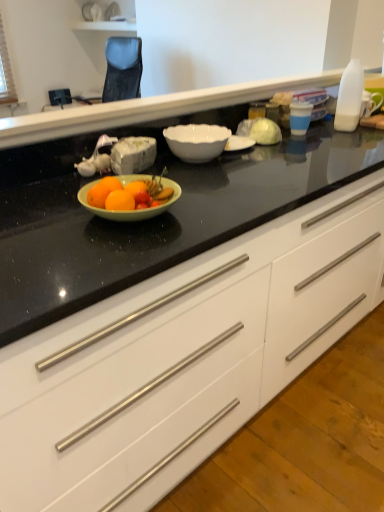
In order to face black glossy countertop at center, should I rotate leftwards or rightwards?

A 9.622 degree turn to the right will do.

Locate an element on the screen. This screenshot has height=512, width=384. black glossy countertop at center is located at coordinates pos(147,109).

Identify the location of white glossy cabinet at center. (183, 357).

The image size is (384, 512). What do you see at coordinates (183, 357) in the screenshot?
I see `white glossy cabinet at center` at bounding box center [183, 357].

You are a GUI agent. You are given a task and a screenshot of the screen. Output one action in this format:
    pyautogui.click(x=<x>, y=<y>)
    Task: Click on the black glossy countertop at center
    This screenshot has height=512, width=384.
    Given the screenshot: What is the action you would take?
    pyautogui.click(x=147, y=109)

Does white glossy cabinet at center have a lesser height compared to black glossy countertop at center?

Incorrect, the height of white glossy cabinet at center does not fall short of that of black glossy countertop at center.

You are a GUI agent. You are given a task and a screenshot of the screen. Output one action in this format:
    pyautogui.click(x=<x>, y=<y>)
    Task: Click on the counter top behind the white glossy cabinet at center
    
    Given the screenshot: What is the action you would take?
    pyautogui.click(x=147, y=109)

How different are the orientations of white glossy cabinet at center and black glossy countertop at center in degrees?

There is a 180-degree angle between the facing directions of white glossy cabinet at center and black glossy countertop at center.

Which is nearer, (315, 288) or (34, 141)?

Positioned in front is point (34, 141).

From the picture: Which of these two, black glossy countertop at center or white glossy bowl at center, is bigger?

Bigger between the two is black glossy countertop at center.

From the image's perspective, between black glossy countertop at center and white glossy bowl at center, who is located below?

white glossy bowl at center appears lower in the image.

Is black glossy countertop at center looking in the opposite direction of white glossy bowl at center?

No, white glossy bowl at center is not at the back of black glossy countertop at center.

Does black glossy countertop at center have a lesser width compared to white glossy bowl at center?

Correct, the width of black glossy countertop at center is less than that of white glossy bowl at center.

Based on the photo, considering the relative sizes of black glossy countertop at center and white glossy cabinet at center in the image provided, is black glossy countertop at center bigger than white glossy cabinet at center?

No.

From the image's perspective, is black glossy countertop at center on white glossy cabinet at center?

Yes, from the image's perspective, black glossy countertop at center is above white glossy cabinet at center.

How many degrees apart are the facing directions of black glossy countertop at center and white glossy cabinet at center?

The angular difference between black glossy countertop at center and white glossy cabinet at center is 180 degrees.

Is black glossy countertop at center not inside white glossy cabinet at center?

black glossy countertop at center lies outside white glossy cabinet at center's area.

Can you tell me how much white glossy cabinet at center and white glossy bowl at center differ in facing direction?

There is a 2.25-degree angle between the facing directions of white glossy cabinet at center and white glossy bowl at center.

From a real-world perspective, is white glossy cabinet at center located higher than white glossy bowl at center?

No, from a real-world perspective, white glossy cabinet at center is not over white glossy bowl at center

Which is behind, white glossy cabinet at center or white glossy bowl at center?

white glossy bowl at center is behind.

Is point (142, 287) farther from camera compared to point (190, 161)?

No.

Which is behind, point (220, 129) or point (194, 112)?

The point (194, 112) is behind.

Who is shorter, white glossy bowl at center or black glossy countertop at center?

Standing shorter between the two is white glossy bowl at center.

Which object is closer to the camera taking this photo, white glossy bowl at center or black glossy countertop at center?

black glossy countertop at center is more forward.

Is white glossy bowl at center positioned with its back to black glossy countertop at center?

No.

The width and height of the screenshot is (384, 512). Identify the location of cabinetry in front of the white glossy bowl at center. (183, 357).

Is white glossy bowl at center facing away from white glossy cabinet at center?

That's right, white glossy bowl at center is facing away from white glossy cabinet at center.

Considering the relative positions of white glossy bowl at center and white glossy cabinet at center in the image provided, is white glossy bowl at center to the right of white glossy cabinet at center from the viewer's perspective?

In fact, white glossy bowl at center is to the left of white glossy cabinet at center.

Looking at this image, considering their positions, is white glossy bowl at center located in front of or behind white glossy cabinet at center?

In the image, white glossy bowl at center appears behind white glossy cabinet at center.

Find the location of a particular element. Image resolution: width=384 pixels, height=512 pixels. cabinetry located in front of the black glossy countertop at center is located at coordinates (183, 357).

At what (x,y) coordinates should I click in order to perform the action: click on bowl below the black glossy countertop at center (from the image's perspective). Please return your answer as a coordinate pair (x, y). Image resolution: width=384 pixels, height=512 pixels. Looking at the image, I should click on (196, 141).

Based on their spatial positions, is white glossy cabinet at center or black glossy countertop at center closer to white glossy bowl at center?

The object closer to white glossy bowl at center is black glossy countertop at center.

Based on their spatial positions, is white glossy bowl at center or black glossy countertop at center further from white glossy cabinet at center?

The object further to white glossy cabinet at center is black glossy countertop at center.

Considering their positions, is black glossy countertop at center positioned closer to white glossy cabinet at center than white glossy bowl at center?

The object closer to white glossy cabinet at center is white glossy bowl at center.

When comparing their distances from black glossy countertop at center, does white glossy cabinet at center or white glossy bowl at center seem closer?

white glossy bowl at center is positioned closer to the anchor black glossy countertop at center.

Consider the image. Estimate the real-world distances between objects in this image. Which object is further from black glossy countertop at center, white glossy bowl at center or white glossy cabinet at center?

Among the two, white glossy cabinet at center is located further to black glossy countertop at center.

From the image, which object appears to be farther from white glossy bowl at center, black glossy countertop at center or white glossy cabinet at center?

white glossy cabinet at center is further to white glossy bowl at center.

This screenshot has height=512, width=384. I want to click on bowl between black glossy countertop at center and white glossy cabinet at center in the vertical direction, so (196, 141).